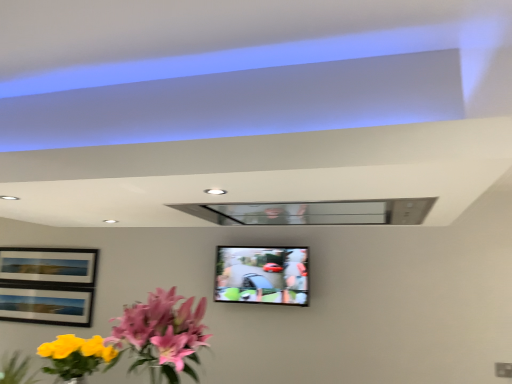
Measure the distance between pink glossy flowers at lower left and camera.

A distance of 5.49 feet exists between pink glossy flowers at lower left and camera.

This screenshot has width=512, height=384. Describe the element at coordinates (162, 333) in the screenshot. I see `pink glossy flowers at lower left` at that location.

Locate an element on the screen. pink glossy flowers at lower left is located at coordinates (162, 333).

This screenshot has width=512, height=384. Describe the element at coordinates (262, 275) in the screenshot. I see `matte black tv at center` at that location.

What is the approximate height of matte black tv at center?

matte black tv at center is 16.58 inches tall.

What are the coordinates of `matte black tv at center` in the screenshot? It's located at (262, 275).

Identify the location of pink glossy flowers at lower left. (162, 333).

Is matte black tv at center to the right of pink glossy flowers at lower left from the viewer's perspective?

Indeed, matte black tv at center is positioned on the right side of pink glossy flowers at lower left.

Which object is closer to the camera, matte black tv at center or pink glossy flowers at lower left?

pink glossy flowers at lower left.

Considering the positions of point (242, 291) and point (131, 347), is point (242, 291) closer or farther from the camera than point (131, 347)?

Point (242, 291) is farther from the camera than point (131, 347).

Looking at this image, from the image's perspective, is matte black tv at center located above pink glossy flowers at lower left?

Indeed, from the image's perspective, matte black tv at center is shown above pink glossy flowers at lower left.

From a real-world perspective, is matte black tv at center physically located above or below pink glossy flowers at lower left?

matte black tv at center is above pink glossy flowers at lower left.

Does matte black tv at center have a lesser width compared to pink glossy flowers at lower left?

Yes, matte black tv at center is thinner than pink glossy flowers at lower left.

Between matte black tv at center and pink glossy flowers at lower left, which one has more height?

pink glossy flowers at lower left.

Considering the relative sizes of matte black tv at center and pink glossy flowers at lower left in the image provided, is matte black tv at center bigger than pink glossy flowers at lower left?

No.

Consider the image. Would you say matte black tv at center is inside or outside pink glossy flowers at lower left?

matte black tv at center is spatially situated outside pink glossy flowers at lower left.

Is matte black tv at center far away from pink glossy flowers at lower left?

Yes, matte black tv at center and pink glossy flowers at lower left are located far from each other.

Is matte black tv at center oriented away from pink glossy flowers at lower left?

matte black tv at center does not have its back to pink glossy flowers at lower left.

In the scene shown: What's the angular difference between matte black tv at center and pink glossy flowers at lower left's facing directions?

The facing directions of matte black tv at center and pink glossy flowers at lower left are 1.7 degrees apart.

From the picture: How distant is matte black tv at center from pink glossy flowers at lower left?

1.05 meters.

Find the location of `television above the pink glossy flowers at lower left (from a real-world perspective)`. television above the pink glossy flowers at lower left (from a real-world perspective) is located at coordinates (262, 275).

Considering the positions of objects pink glossy flowers at lower left and matte black tv at center in the image provided, who is more to the right, pink glossy flowers at lower left or matte black tv at center?

From the viewer's perspective, matte black tv at center appears more on the right side.

Which is in front, pink glossy flowers at lower left or matte black tv at center?

pink glossy flowers at lower left is more forward.

Is point (151, 364) in front of point (289, 289)?

Yes, it is in front of point (289, 289).

From the image's perspective, which one is positioned lower, pink glossy flowers at lower left or matte black tv at center?

pink glossy flowers at lower left is shown below in the image.

From a real-world perspective, is pink glossy flowers at lower left on matte black tv at center?

No, from a real-world perspective, pink glossy flowers at lower left is not on top of matte black tv at center.

Between pink glossy flowers at lower left and matte black tv at center, which one has larger width?

pink glossy flowers at lower left.

Who is shorter, pink glossy flowers at lower left or matte black tv at center?

Standing shorter between the two is matte black tv at center.

Is pink glossy flowers at lower left bigger or smaller than matte black tv at center?

In the image, pink glossy flowers at lower left appears to be larger than matte black tv at center.

Would you say pink glossy flowers at lower left is inside or outside matte black tv at center?

pink glossy flowers at lower left is not inside matte black tv at center, it's outside.

Is the surface of pink glossy flowers at lower left in direct contact with matte black tv at center?

pink glossy flowers at lower left is not next to matte black tv at center, and they're not touching.

Does pink glossy flowers at lower left turn towards matte black tv at center?

No, pink glossy flowers at lower left is not turned towards matte black tv at center.

Can you tell me how much pink glossy flowers at lower left and matte black tv at center differ in facing direction?

The facing directions of pink glossy flowers at lower left and matte black tv at center are 1.7 degrees apart.

This screenshot has height=384, width=512. I want to click on flower below the matte black tv at center (from a real-world perspective), so click(x=162, y=333).

This screenshot has height=384, width=512. In order to click on flower in front of the matte black tv at center in this screenshot , I will do `click(162, 333)`.

The height and width of the screenshot is (384, 512). There is a pink glossy flowers at lower left. Identify the location of television above it (from a real-world perspective). (262, 275).